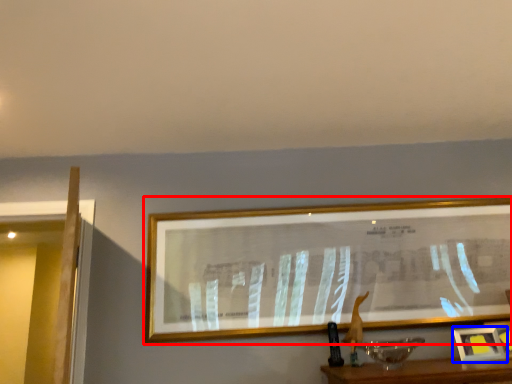
Question: Which of the following is the farthest to the observer, picture frame (highlighted by a red box) or picture frame (highlighted by a blue box)?

Choices:
 (A) picture frame
 (B) picture frame

Answer: (A)